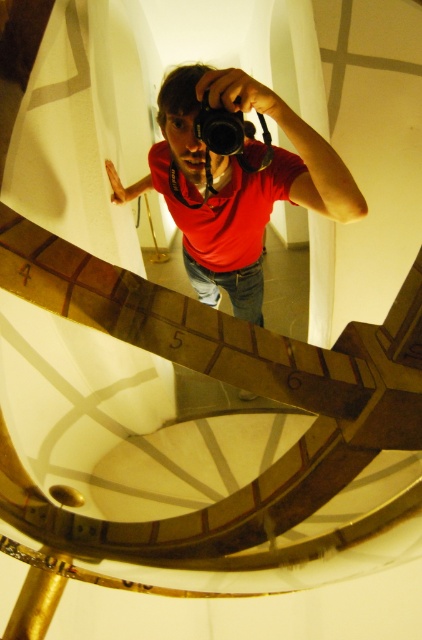
Does matte red shirt at center have a lesser height compared to black plastic camera at upper center?

No.

Between point (248, 193) and point (221, 120), which one is positioned in front?

Positioned in front is point (221, 120).

At what (x,y) coordinates should I click in order to perform the action: click on matte red shirt at center. Please return your answer as a coordinate pair (x, y). Image resolution: width=422 pixels, height=640 pixels. Looking at the image, I should click on (235, 182).